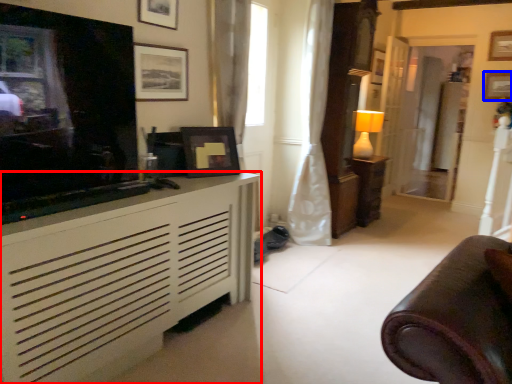
Question: Which object appears farthest to the camera in this image, cabinetry (highlighted by a red box) or picture frame (highlighted by a blue box)?

Choices:
 (A) cabinetry
 (B) picture frame

Answer: (B)